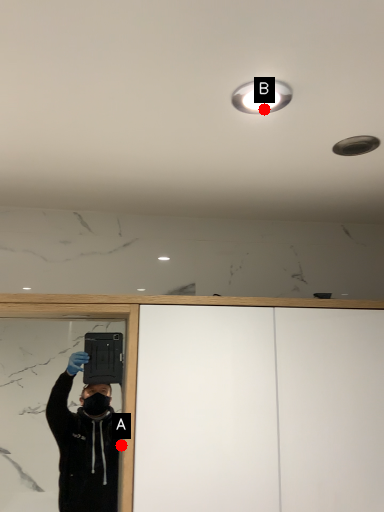
Question: Two points are circled on the image, labeled by A and B beside each circle. Which point is closer to the camera?

Choices:
 (A) A is closer
 (B) B is closer

Answer: (B)